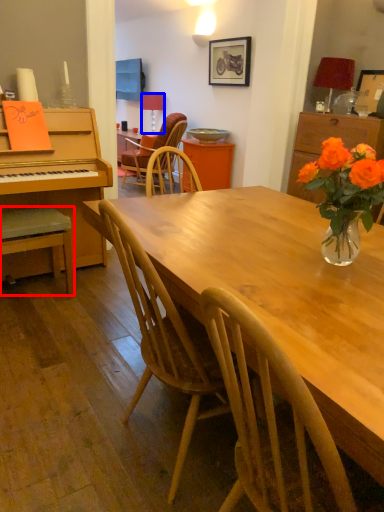
Question: Which object is further to the camera taking this photo, chair (highlighted by a red box) or lamp (highlighted by a blue box)?

Choices:
 (A) chair
 (B) lamp

Answer: (B)